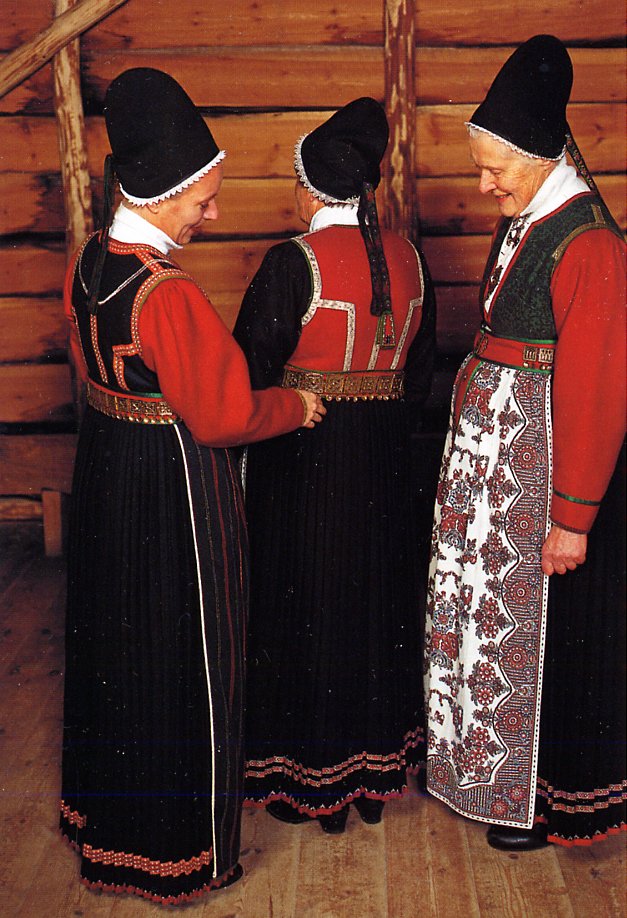
The width and height of the screenshot is (627, 918). Find the location of `wooden wall`. wooden wall is located at coordinates (274, 57).